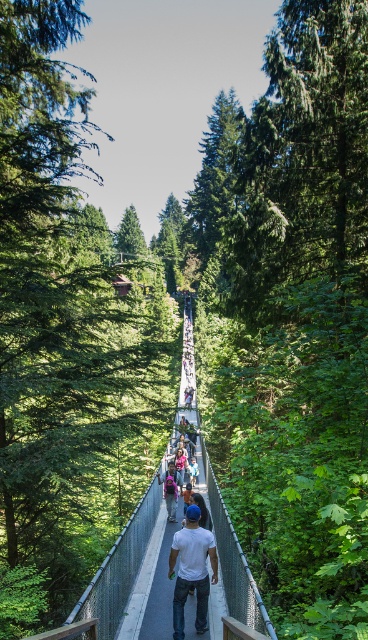
Can you confirm if metallic chain-link bridge at center is positioned above light blue denim jeans at center?

Correct, metallic chain-link bridge at center is located above light blue denim jeans at center.

Does point (188, 456) come behind point (189, 474)?

Yes.

I want to click on metallic chain-link bridge at center, so click(161, 589).

Which is in front, point (199, 563) or point (190, 472)?

Point (199, 563)

Is white matte shirt at center wider than light blue denim jeans at center?

Yes, white matte shirt at center is wider than light blue denim jeans at center.

Where is `white matte shirt at center`? This screenshot has height=640, width=368. white matte shirt at center is located at coordinates (192, 570).

Which is behind, point (189, 624) or point (199, 563)?

Point (189, 624)

Between metallic chain-link bridge at center and white matte shirt at center, which one is positioned higher?

metallic chain-link bridge at center is above.

Image resolution: width=368 pixels, height=640 pixels. Find the location of `metallic chain-link bridge at center`. metallic chain-link bridge at center is located at coordinates coord(161,589).